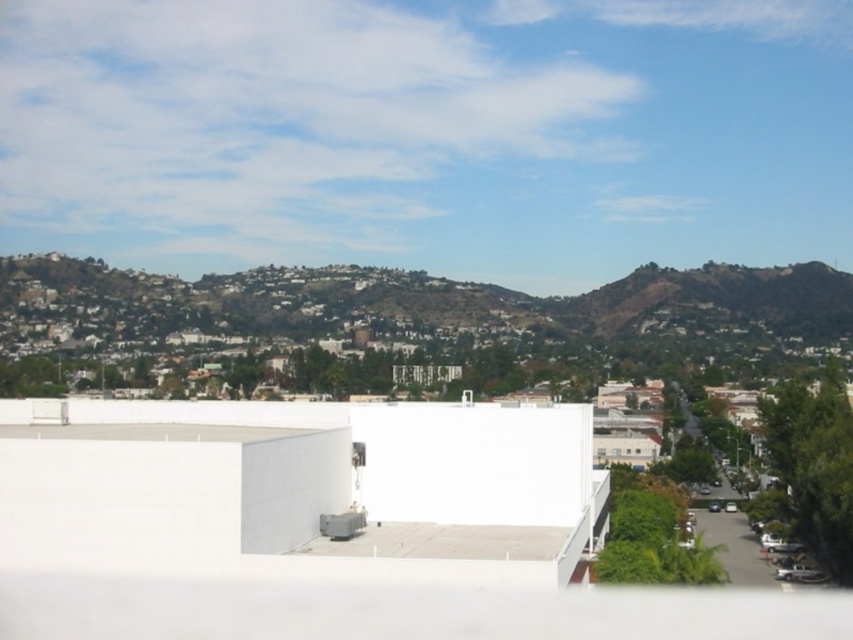
Does white smooth building at center have a smaller size compared to green grassy hillside at upper center?

Yes.

The image size is (853, 640). What are the coordinates of `white smooth building at center` in the screenshot? It's located at (300, 486).